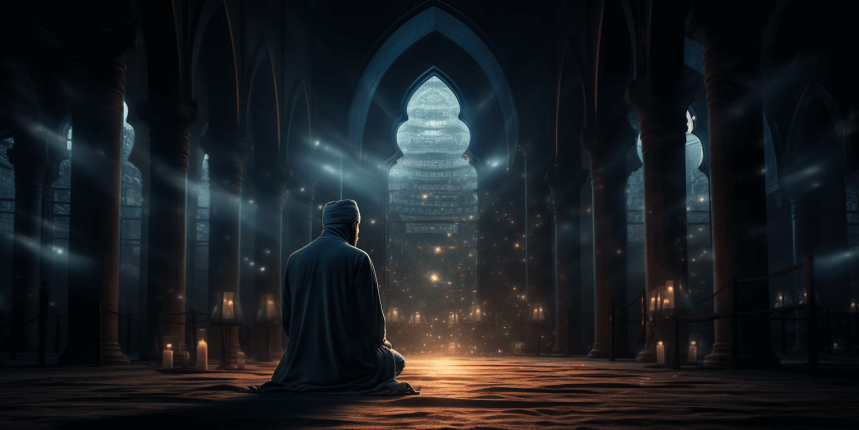
Image resolution: width=859 pixels, height=430 pixels. Identify the location of arched doorway. (431, 75).